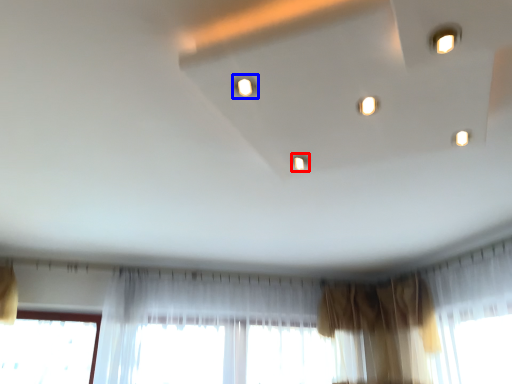
Question: Which point is closer to the camera, light (highlighted by a red box) or light (highlighted by a blue box)?

Choices:
 (A) light
 (B) light

Answer: (B)